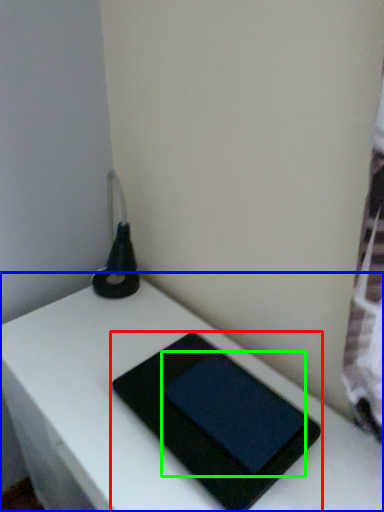
Question: Considering the real-world distances, which object is closest to tablet computer (highlighted by a red box)? table (highlighted by a blue box) or tablet computer (highlighted by a green box).

Choices:
 (A) table
 (B) tablet computer

Answer: (B)